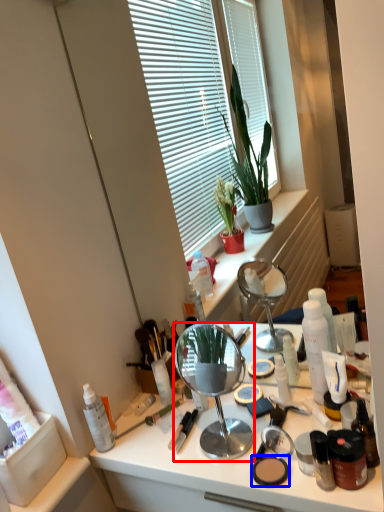
Question: Which point is closer to the camera, mirror (highlighted by a red box) or face powder (highlighted by a blue box)?

Choices:
 (A) mirror
 (B) face powder

Answer: (A)